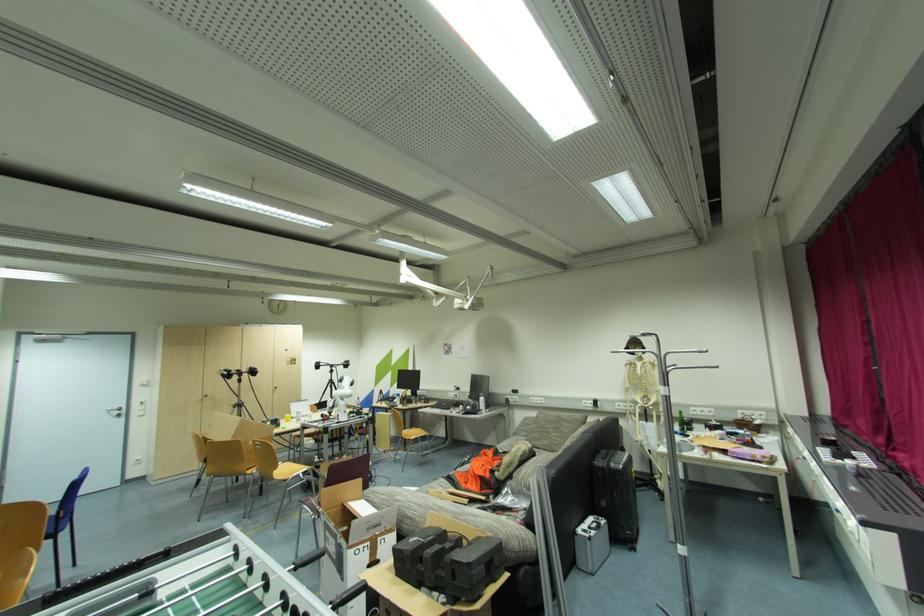
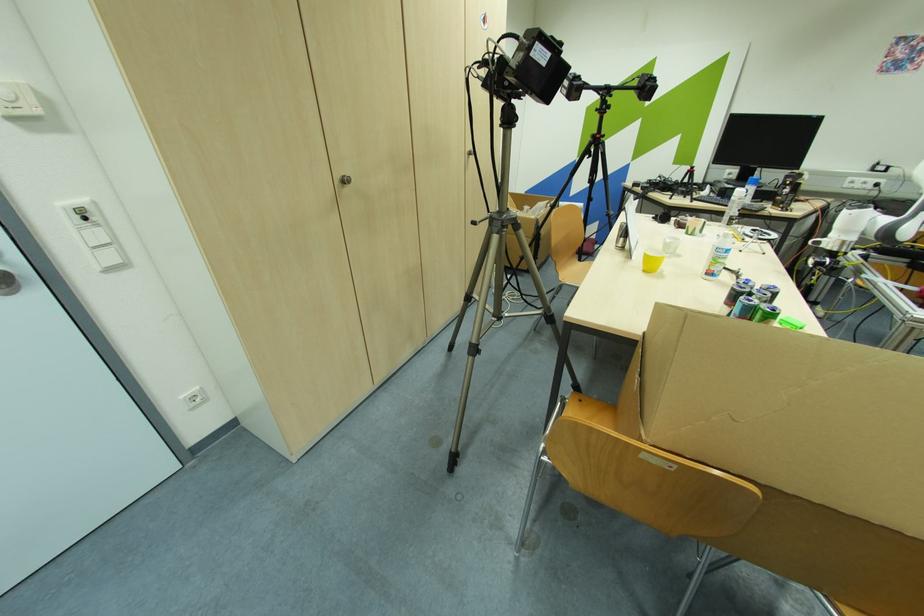
Find the pixel in the second image that matches [210,397] in the first image.

(348, 182)